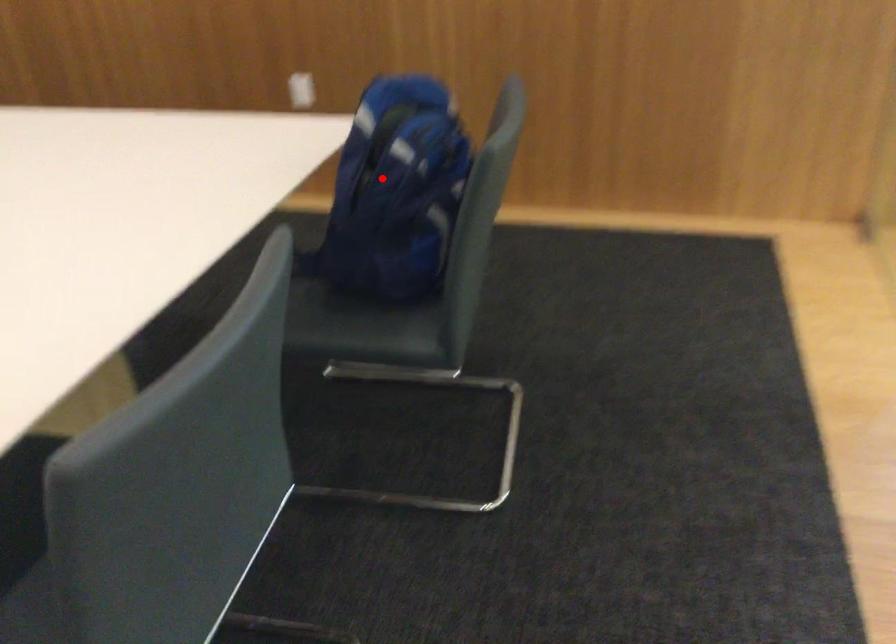
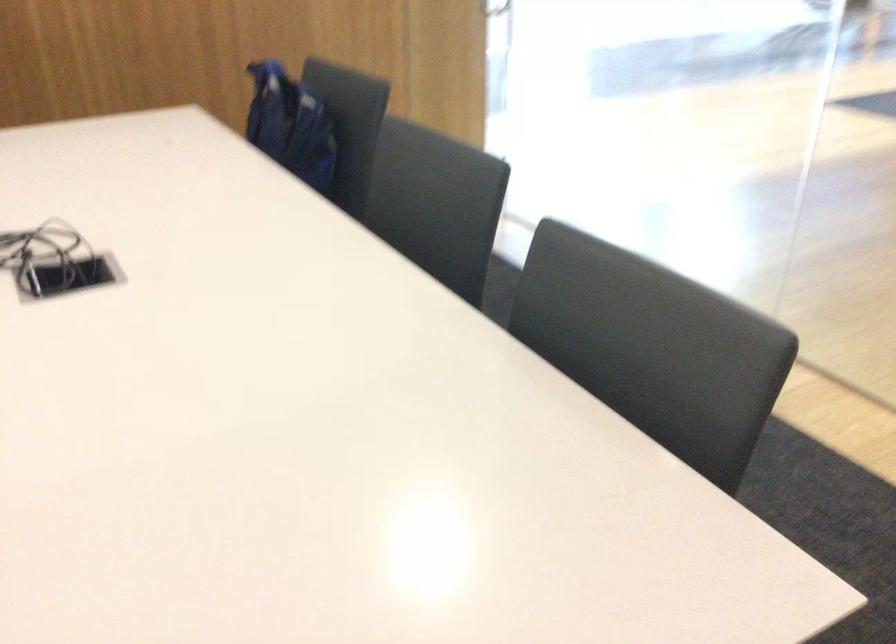
Question: I am providing you with two images of the same scene from different viewpoints. In image1, a red point is highlighted. Considering the same 3D point in image2, which of the following is correct?

Choices:
 (A) It is closer
 (B) It is farther

Answer: (B)